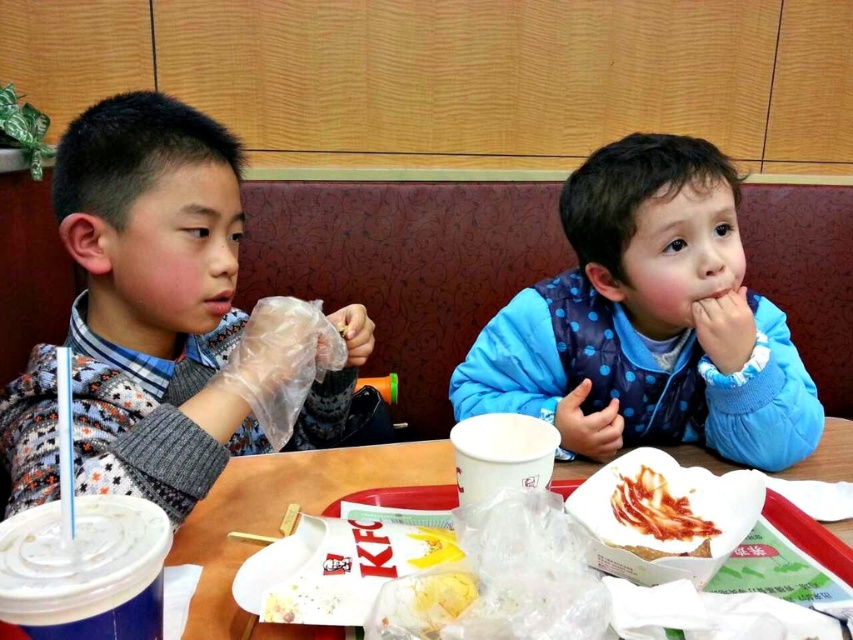
You are a customer in the restaurant and want to place your drink between the patterned sweater at left and the blue dotted vest at center. Based on their positions, where should you place the drink?

Since the patterned sweater at left is located above the blue dotted vest at center, you should place the drink below the patterned sweater at left and above the blue dotted vest at center to position it between them.

You are a food delivery person who needs to place a new order on the table. The order must be placed to the right of the shiny red bacon at center. Where should you place it relative to the patterned sweater at left?

Since the patterned sweater at left is to the left of the shiny red bacon at center, placing the new order to the right of the shiny red bacon at center would mean positioning it further to the right beyond the shiny red bacon at center, away from the patterned sweater at left.